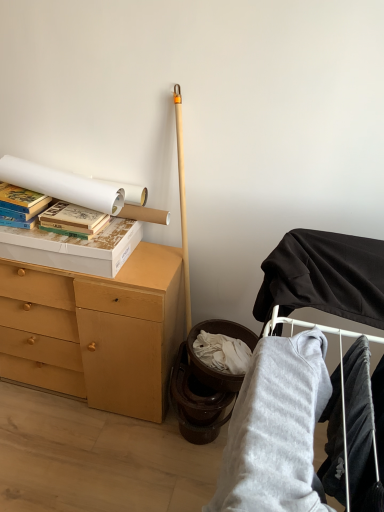
You are a GUI agent. You are given a task and a screenshot of the screen. Output one action in this format:
    pyautogui.click(x=<x>, y=<y>)
    Task: Click on the free space above matte cardboard book at upper left, the 2th paperback book viewed from the left (from a real-world perspective)
    This screenshot has height=512, width=384.
    Given the screenshot: What is the action you would take?
    pyautogui.click(x=73, y=208)